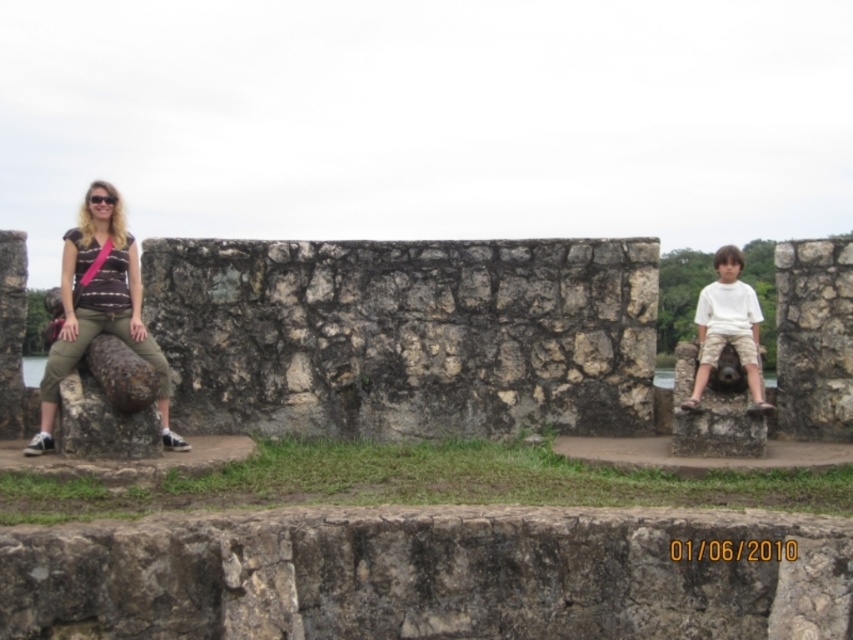
Measure the distance from matte black shirt at left to white cotton shirt at right.

matte black shirt at left and white cotton shirt at right are 22.36 meters apart from each other.

Between matte black shirt at left and white cotton shirt at right, which one is positioned higher?

matte black shirt at left

Find the location of a particular element. This screenshot has width=853, height=640. matte black shirt at left is located at coordinates (99, 307).

At what (x,y) coordinates should I click in order to perform the action: click on matte black shirt at left. Please return your answer as a coordinate pair (x, y). The height and width of the screenshot is (640, 853). Looking at the image, I should click on (99, 307).